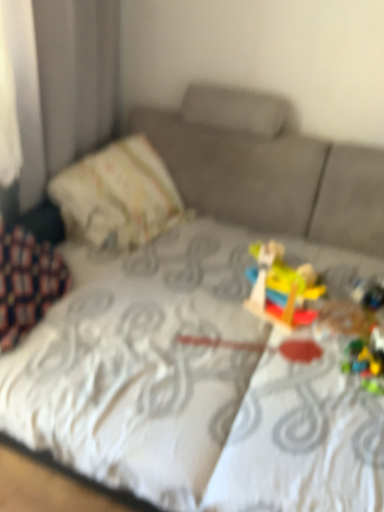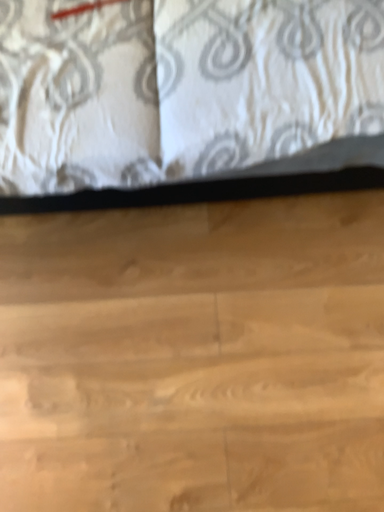
Question: Which way did the camera rotate in the video?

Choices:
 (A) rotated right
 (B) rotated left

Answer: (A)